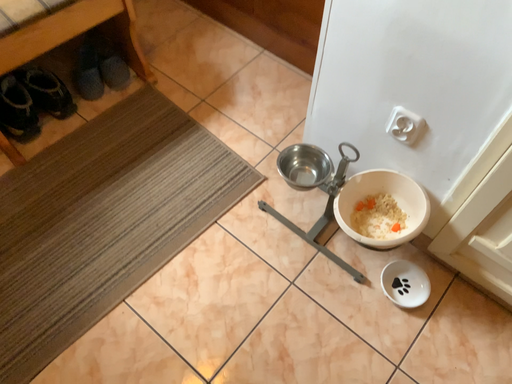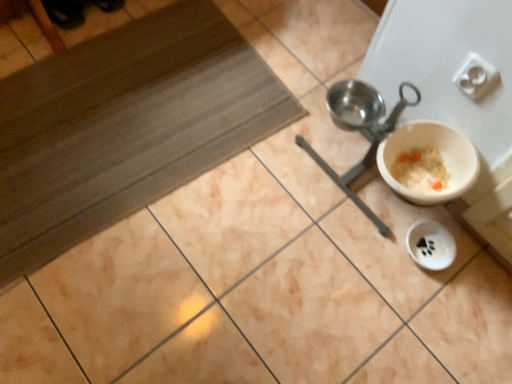
Question: How did the camera likely rotate when shooting the video?

Choices:
 (A) rotated upward
 (B) rotated downward

Answer: (B)